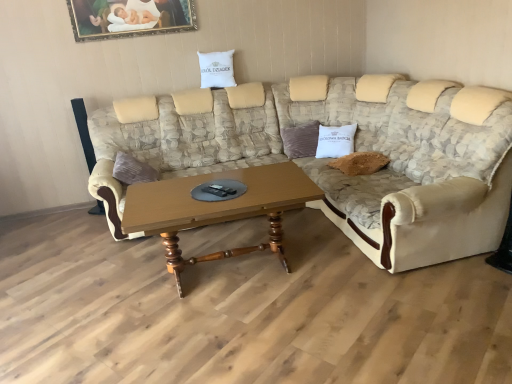
Question: Can you confirm if gold-framed painting at upper center is thinner than white cotton pillow at upper center, which is the second pillow from right to left?

Choices:
 (A) yes
 (B) no

Answer: (A)

Question: Is there a large distance between gold-framed painting at upper center and white cotton pillow at upper center, placed as the first pillow when sorted from top to bottom?

Choices:
 (A) no
 (B) yes

Answer: (A)

Question: Does gold-framed painting at upper center appear on the right side of white cotton pillow at upper center, which ranks as the second pillow in bottom-to-top order?

Choices:
 (A) no
 (B) yes

Answer: (A)

Question: Is gold-framed painting at upper center smaller than white cotton pillow at upper center, which ranks as the second pillow in bottom-to-top order?

Choices:
 (A) yes
 (B) no

Answer: (A)

Question: Can you confirm if gold-framed painting at upper center is shorter than white cotton pillow at upper center, placed as the first pillow when sorted from top to bottom?

Choices:
 (A) yes
 (B) no

Answer: (A)

Question: From the image's perspective, relative to beige fabric couch at center, is gold-framed painting at upper center above or below?

Choices:
 (A) above
 (B) below

Answer: (A)

Question: Choose the correct answer: Is gold-framed painting at upper center inside beige fabric couch at center or outside it?

Choices:
 (A) outside
 (B) inside

Answer: (A)

Question: In the image, is gold-framed painting at upper center on the left side or the right side of beige fabric couch at center?

Choices:
 (A) right
 (B) left

Answer: (B)

Question: Considering the positions of point (135, 6) and point (437, 251), is point (135, 6) closer or farther from the camera than point (437, 251)?

Choices:
 (A) closer
 (B) farther

Answer: (B)

Question: Would you say wooden polished coffee table at center is inside or outside white cotton pillow at upper center, which ranks as the second pillow in bottom-to-top order?

Choices:
 (A) inside
 (B) outside

Answer: (B)

Question: From the image's perspective, is wooden polished coffee table at center located above or below white cotton pillow at upper center, which is the second pillow from right to left?

Choices:
 (A) above
 (B) below

Answer: (B)

Question: Considering the positions of point (176, 246) and point (203, 71), is point (176, 246) closer or farther from the camera than point (203, 71)?

Choices:
 (A) farther
 (B) closer

Answer: (B)

Question: Visually, is wooden polished coffee table at center positioned to the left or to the right of white cotton pillow at upper center, placed as the first pillow when sorted from top to bottom?

Choices:
 (A) left
 (B) right

Answer: (B)

Question: In terms of width, does white cotton pillow at center, marked as the first pillow in a right-to-left arrangement, look wider or thinner when compared to gold-framed painting at upper center?

Choices:
 (A) wide
 (B) thin

Answer: (A)

Question: Relative to gold-framed painting at upper center, is white cotton pillow at center, marked as the first pillow in a bottom-to-top arrangement, in front or behind?

Choices:
 (A) front
 (B) behind

Answer: (A)